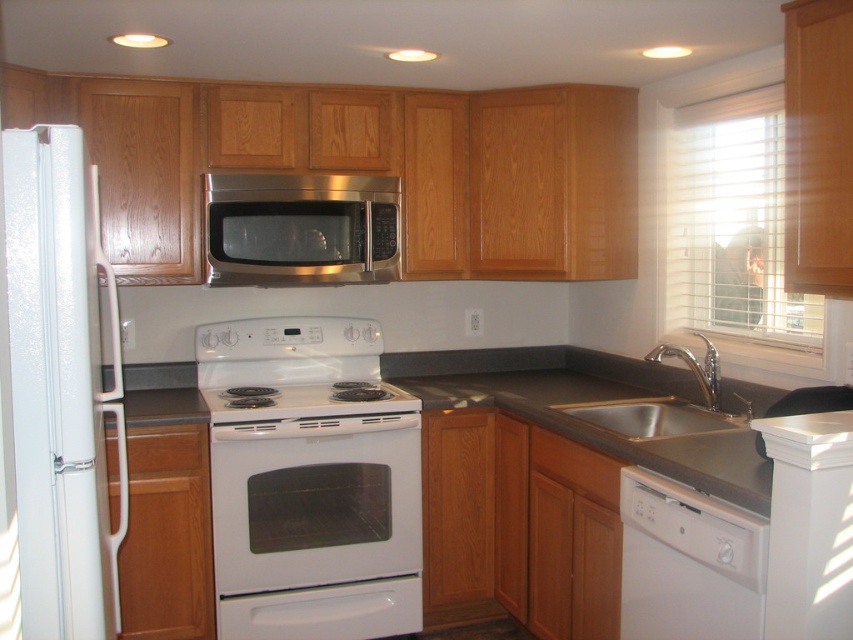
Can you confirm if white glossy oven at center is wider than stainless steel microwave at center?

Indeed, white glossy oven at center has a greater width compared to stainless steel microwave at center.

Is white glossy oven at center smaller than stainless steel microwave at center?

Actually, white glossy oven at center might be larger than stainless steel microwave at center.

The height and width of the screenshot is (640, 853). In order to click on white glossy oven at center in this screenshot , I will do 317,528.

At what (x,y) coordinates should I click in order to perform the action: click on white glossy oven at center. Please return your answer as a coordinate pair (x, y). Looking at the image, I should click on (317, 528).

Can you confirm if white glossy refrigerator at left is taller than silver metallic sink at lower right?

Yes.

Can you confirm if white glossy refrigerator at left is positioned to the right of silver metallic sink at lower right?

No, white glossy refrigerator at left is not to the right of silver metallic sink at lower right.

Is point (84, 164) farther from camera compared to point (654, 432)?

No.

The width and height of the screenshot is (853, 640). I want to click on white glossy refrigerator at left, so click(x=61, y=387).

Is point (728, 536) positioned behind point (611, 420)?

No, it is in front of (611, 420).

Who is shorter, white glossy dishwasher at lower right or silver metallic sink at lower right?

Standing shorter between the two is silver metallic sink at lower right.

Who is more distant from viewer, (732, 528) or (666, 424)?

Point (666, 424)

At what (x,y) coordinates should I click in order to perform the action: click on white glossy dishwasher at lower right. Please return your answer as a coordinate pair (x, y). Looking at the image, I should click on (688, 563).